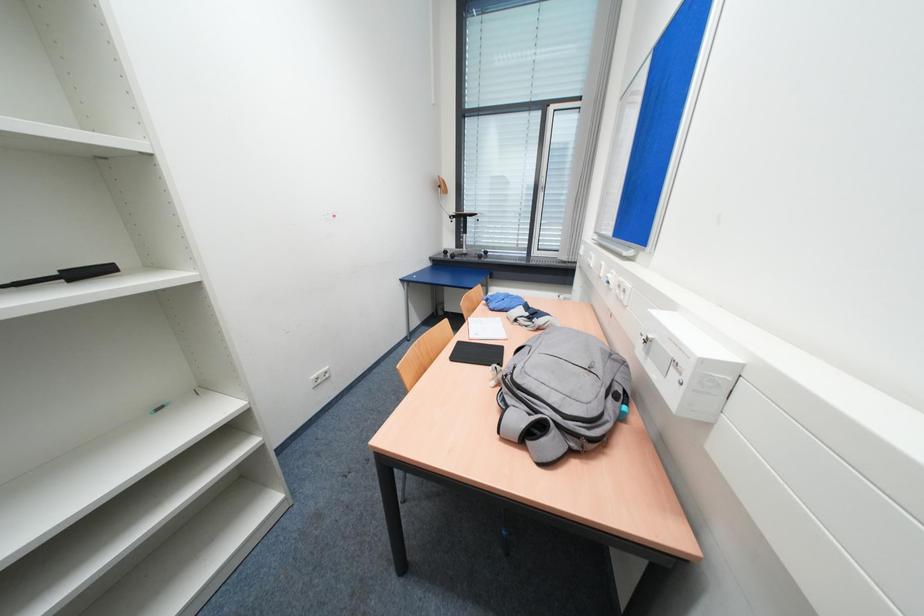
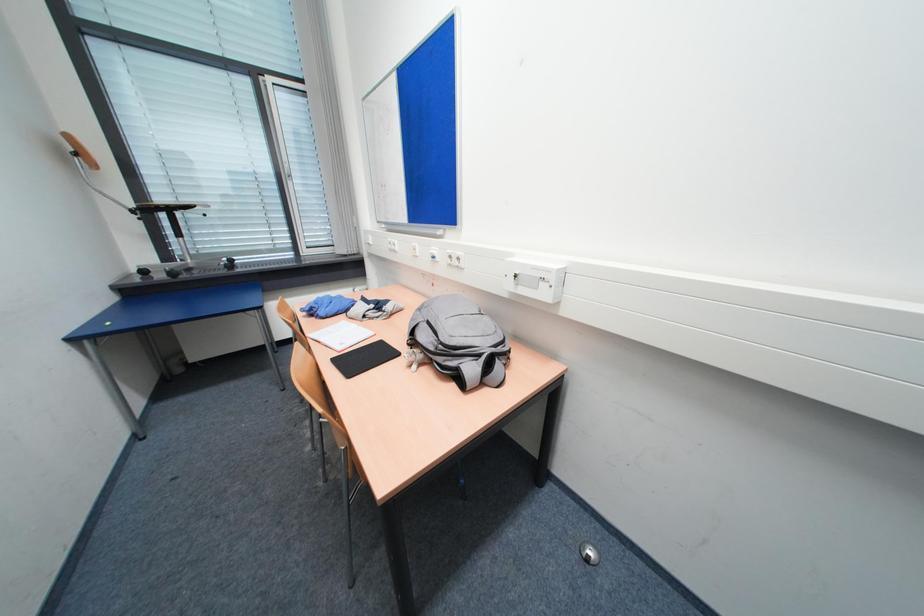
Question: The camera is either moving clockwise (left) or counter-clockwise (right) around the object. The first image is from the beginning of the video and the second image is from the end. Is the camera moving left or right when shooting the video?

Choices:
 (A) Left
 (B) Right

Answer: (A)